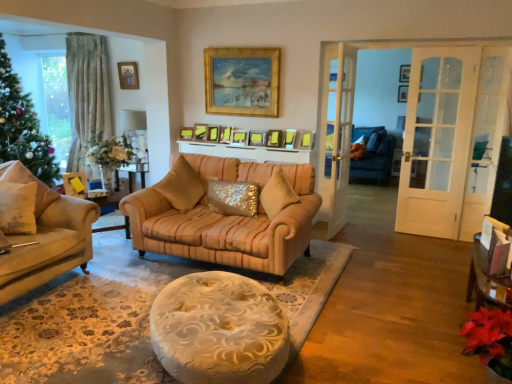
Question: From the image's perspective, is sparkly gold pillow at center, the second pillow positioned from the right, on matte gold picture frame at center, which is the eleventh picture frame in right-to-left order?

Choices:
 (A) yes
 (B) no

Answer: (B)

Question: Would you say sparkly gold pillow at center, the second pillow positioned from the right, is a long distance from matte gold picture frame at center, which is the fourth picture frame from back to front?

Choices:
 (A) yes
 (B) no

Answer: (A)

Question: Does sparkly gold pillow at center, the second pillow positioned from the right, have a lesser width compared to matte gold picture frame at center, which ranks as the 2th picture frame in left-to-right order?

Choices:
 (A) no
 (B) yes

Answer: (A)

Question: Is sparkly gold pillow at center, the 4th pillow viewed from the left, at the left side of matte gold picture frame at center, which is the fourth picture frame from back to front?

Choices:
 (A) no
 (B) yes

Answer: (A)

Question: Is matte gold picture frame at center, which is the fourth picture frame from back to front, at the back of sparkly gold pillow at center, the 4th pillow viewed from the left?

Choices:
 (A) no
 (B) yes

Answer: (A)

Question: Looking at their shapes, would you say wooden picture frame at upper center, marked as the eleventh picture frame in a left-to-right arrangement, is wider or thinner than matte gold picture frame at center, acting as the 5th picture frame starting from the left?

Choices:
 (A) wide
 (B) thin

Answer: (B)

Question: From a real-world perspective, is wooden picture frame at upper center, marked as the twelfth picture frame in a front-to-back arrangement, positioned above or below matte gold picture frame at center, acting as the 5th picture frame starting from the left?

Choices:
 (A) below
 (B) above

Answer: (B)

Question: In the image, is wooden picture frame at upper center, marked as the eleventh picture frame in a left-to-right arrangement, on the left side or the right side of matte gold picture frame at center, acting as the 5th picture frame starting from the left?

Choices:
 (A) left
 (B) right

Answer: (B)

Question: Considering the positions of point (402, 99) and point (228, 135), is point (402, 99) closer or farther from the camera than point (228, 135)?

Choices:
 (A) farther
 (B) closer

Answer: (A)

Question: In terms of height, does matte white lampshade at upper left look taller or shorter compared to matte yellow picture frame at center, acting as the 10th picture frame starting from the right?

Choices:
 (A) tall
 (B) short

Answer: (A)

Question: Is matte white lampshade at upper left in front of or behind matte yellow picture frame at center, which ranks as the third picture frame in left-to-right order, in the image?

Choices:
 (A) front
 (B) behind

Answer: (B)

Question: Based on their positions, is matte white lampshade at upper left located to the left or right of matte yellow picture frame at center, acting as the 10th picture frame starting from the right?

Choices:
 (A) right
 (B) left

Answer: (B)

Question: From a real-world perspective, relative to matte yellow picture frame at center, acting as the 10th picture frame starting from the right, is matte white lampshade at upper left vertically above or below?

Choices:
 (A) above
 (B) below

Answer: (B)

Question: From a real-world perspective, relative to green matte christmas tree at left, is wooden picture frame at upper left, marked as the 12th picture frame in a right-to-left arrangement, vertically above or below?

Choices:
 (A) below
 (B) above

Answer: (B)

Question: Looking at the image, does wooden picture frame at upper left, the 3th picture frame positioned from the back, seem bigger or smaller compared to green matte christmas tree at left?

Choices:
 (A) small
 (B) big

Answer: (A)